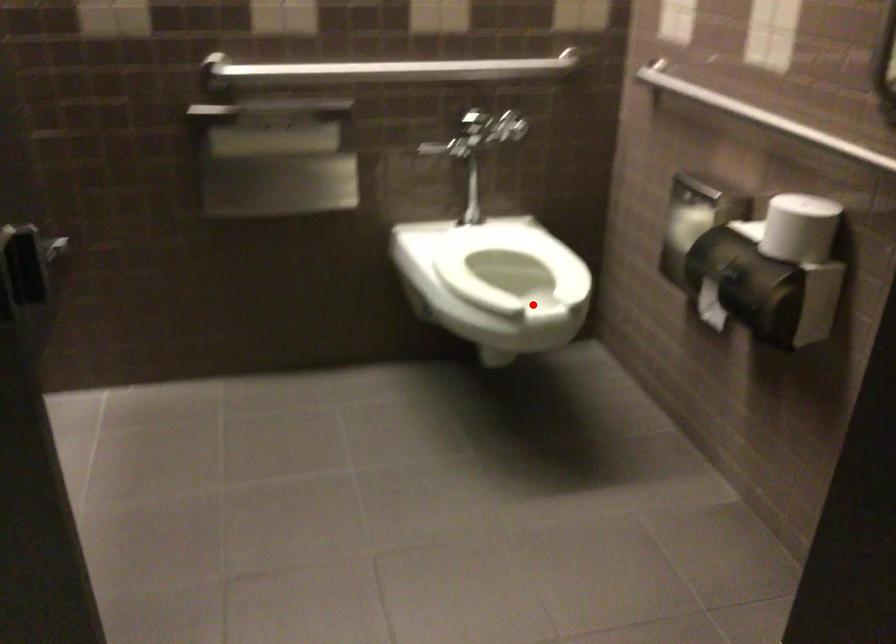
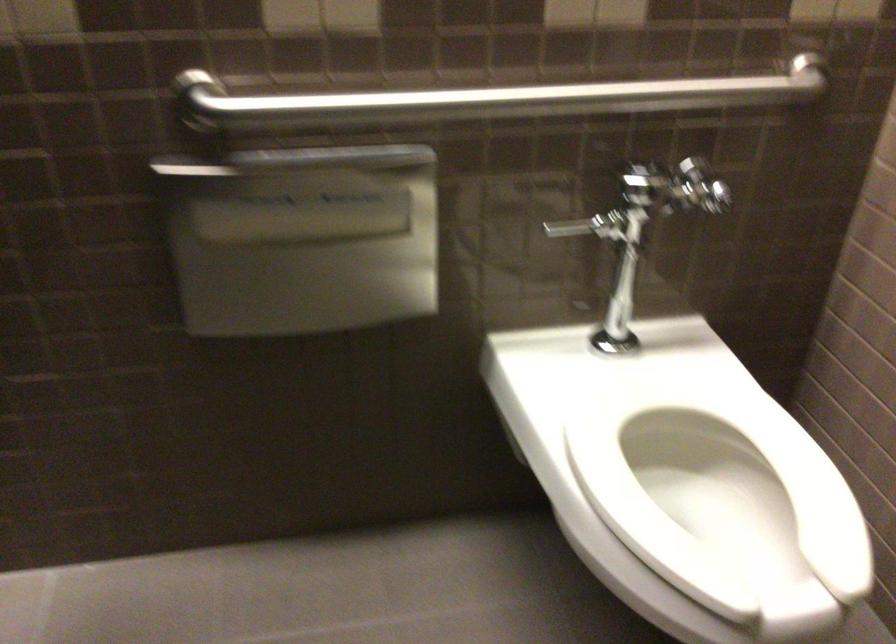
Question: I am providing you with two images of the same scene from different viewpoints. A red point is marked on the first image. At the location where the point appears in image 1, is it still visible in image 2?

Choices:
 (A) Yes
 (B) No

Answer: (A)